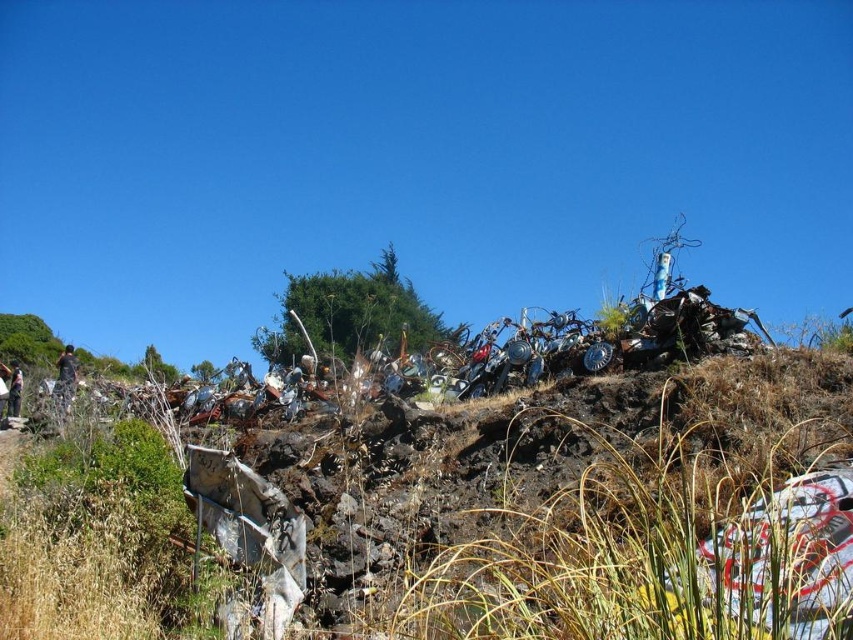
Question: Does camouflage fabric jacket at left appear on the right side of camouflage fabric shirt at lower left?

Choices:
 (A) no
 (B) yes

Answer: (B)

Question: Which object is farther from the camera taking this photo?

Choices:
 (A) camouflage fabric shirt at lower left
 (B) brown dry grass at lower left

Answer: (A)

Question: Does brown dry grass at lower left have a larger size compared to camouflage fabric shirt at lower left?

Choices:
 (A) no
 (B) yes

Answer: (B)

Question: Can you confirm if brown dry grass at lower left is smaller than camouflage fabric jacket at left?

Choices:
 (A) yes
 (B) no

Answer: (B)

Question: Which is farther from the camouflage fabric jacket at left?

Choices:
 (A) brown dry grass at lower left
 (B) camouflage fabric shirt at lower left

Answer: (A)

Question: Considering the real-world distances, which object is closest to the camouflage fabric jacket at left?

Choices:
 (A) camouflage fabric shirt at lower left
 (B) brown dry grass at lower left

Answer: (A)